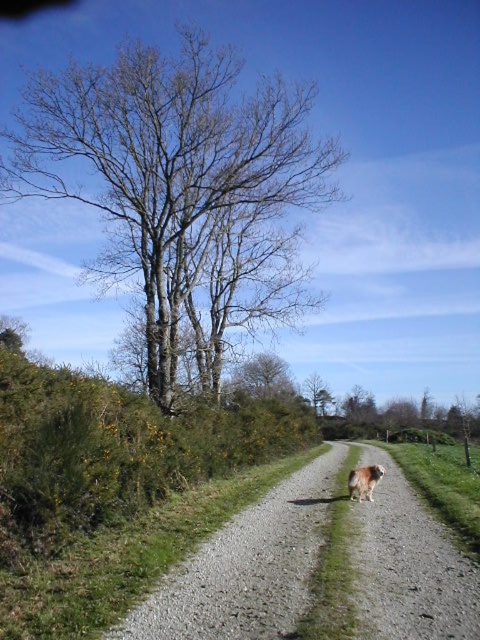
Can you confirm if bare wood tree at upper left is positioned above brown leafless tree at upper center?

Yes.

You are a GUI agent. You are given a task and a screenshot of the screen. Output one action in this format:
    pyautogui.click(x=<x>, y=<y>)
    Task: Click on the bare wood tree at upper left
    
    Given the screenshot: What is the action you would take?
    pos(167,170)

The image size is (480, 640). In order to click on bare wood tree at upper left in this screenshot , I will do `click(167, 170)`.

Can you confirm if brown leafless tree at upper center is shorter than brown fluffy dog at right?

Incorrect, brown leafless tree at upper center's height does not fall short of brown fluffy dog at right's.

Locate an element on the screen. This screenshot has width=480, height=640. brown leafless tree at upper center is located at coordinates (264, 378).

Is point (276, 374) farther from viewer compared to point (382, 472)?

Yes, it is behind point (382, 472).

The height and width of the screenshot is (640, 480). I want to click on brown leafless tree at upper center, so click(264, 378).

Can you confirm if gravelly dirt road at center is positioned to the left of brown leafless tree at upper center?

Yes, gravelly dirt road at center is to the left of brown leafless tree at upper center.

Measure the distance between gravelly dirt road at center and camera.

gravelly dirt road at center is 201.95 feet from camera.

Is point (441, 632) in front of point (248, 364)?

Yes, point (441, 632) is closer to viewer.

Where is `gravelly dirt road at center`? This screenshot has height=640, width=480. gravelly dirt road at center is located at coordinates (247, 566).